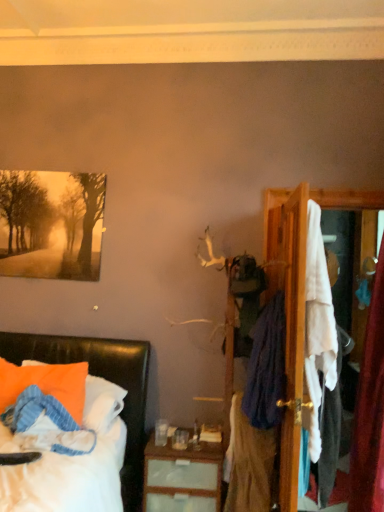
Identify the location of matte paper painting at upper left. (51, 224).

The width and height of the screenshot is (384, 512). Describe the element at coordinates (248, 463) in the screenshot. I see `velvety purple scarf at right, the second clothing when ordered from top to bottom` at that location.

You are a GUI agent. You are given a task and a screenshot of the screen. Output one action in this format:
    pyautogui.click(x=<x>, y=<y>)
    Task: Click on the dark blue fabric at right, the 1th clothing positioned from the top
    This screenshot has width=384, height=512.
    Given the screenshot: What is the action you would take?
    pyautogui.click(x=266, y=367)

The width and height of the screenshot is (384, 512). Find the location of `matte black bed at lower left`. matte black bed at lower left is located at coordinates (105, 378).

You are a GUI agent. You are given a task and a screenshot of the screen. Output one action in this format:
    pyautogui.click(x=<x>, y=<y>)
    Task: Click on the orange fabric pillow at lower left
    
    Given the screenshot: What is the action you would take?
    pyautogui.click(x=45, y=383)

Is dark blue fabric at right, the 1th clothing positioned from the top, inside or outside of velvety purple scarf at right, which appears as the first clothing when ordered from the bottom?

dark blue fabric at right, the 1th clothing positioned from the top, lies outside velvety purple scarf at right, which appears as the first clothing when ordered from the bottom.

From a real-world perspective, which object stands above the other?

dark blue fabric at right, the 1th clothing positioned from the top.

Is dark blue fabric at right, the second clothing when ordered from bottom to top, taller or shorter than velvety purple scarf at right, the second clothing when ordered from top to bottom?

In the image, dark blue fabric at right, the second clothing when ordered from bottom to top, appears to be taller than velvety purple scarf at right, the second clothing when ordered from top to bottom.

Is velvety purple scarf at right, the second clothing when ordered from top to bottom, at the back of dark blue fabric at right, the 1th clothing positioned from the top?

That's not correct — dark blue fabric at right, the 1th clothing positioned from the top, is not looking away from velvety purple scarf at right, the second clothing when ordered from top to bottom.

From the image's perspective, does matte black bed at lower left appear higher than dark blue fabric at right, the second clothing when ordered from bottom to top?

Incorrect, from the image's perspective, matte black bed at lower left is lower than dark blue fabric at right, the second clothing when ordered from bottom to top.

Is matte black bed at lower left bigger than dark blue fabric at right, the 1th clothing positioned from the top?

Yes.

Where is `bed that is below the dark blue fabric at right, the 1th clothing positioned from the top (from the image's perspective)`? The width and height of the screenshot is (384, 512). bed that is below the dark blue fabric at right, the 1th clothing positioned from the top (from the image's perspective) is located at coordinates (105, 378).

Is velvety purple scarf at right, the second clothing when ordered from top to bottom, surrounding wooden dresser at right?

No.

From a real-world perspective, which object rests below the other?

In real-world perspective, velvety purple scarf at right, the second clothing when ordered from top to bottom, is lower.

Considering the positions of objects velvety purple scarf at right, the second clothing when ordered from top to bottom, and wooden dresser at right in the image provided, who is in front, velvety purple scarf at right, the second clothing when ordered from top to bottom, or wooden dresser at right?

velvety purple scarf at right, the second clothing when ordered from top to bottom, is in front.

Does velvety purple scarf at right, the second clothing when ordered from top to bottom, touch wooden dresser at right?

No, velvety purple scarf at right, the second clothing when ordered from top to bottom, is not touching wooden dresser at right.

Considering the relative positions of dark blue fabric at right, the second clothing when ordered from bottom to top, and matte paper painting at upper left in the image provided, is dark blue fabric at right, the second clothing when ordered from bottom to top, in front of matte paper painting at upper left?

Yes, it is.

Is dark blue fabric at right, the 1th clothing positioned from the top, situated inside matte paper painting at upper left or outside?

dark blue fabric at right, the 1th clothing positioned from the top, is located beyond the bounds of matte paper painting at upper left.

Would you consider dark blue fabric at right, the second clothing when ordered from bottom to top, to be distant from matte paper painting at upper left?

Yes.

Does dark blue fabric at right, the second clothing when ordered from bottom to top, have a lesser width compared to matte paper painting at upper left?

In fact, dark blue fabric at right, the second clothing when ordered from bottom to top, might be wider than matte paper painting at upper left.

Which of these two, velvety purple scarf at right, the second clothing when ordered from top to bottom, or dark blue fabric at right, the 1th clothing positioned from the top, is smaller?

velvety purple scarf at right, the second clothing when ordered from top to bottom.

Considering the sizes of objects velvety purple scarf at right, the second clothing when ordered from top to bottom, and dark blue fabric at right, the second clothing when ordered from bottom to top, in the image provided, who is shorter, velvety purple scarf at right, the second clothing when ordered from top to bottom, or dark blue fabric at right, the second clothing when ordered from bottom to top,?

With less height is velvety purple scarf at right, the second clothing when ordered from top to bottom.

Is velvety purple scarf at right, the second clothing when ordered from top to bottom, looking in the opposite direction of dark blue fabric at right, the 1th clothing positioned from the top?

No.

Which object is thinner, velvety purple scarf at right, which appears as the first clothing when ordered from the bottom, or dark blue fabric at right, the 1th clothing positioned from the top?

With smaller width is dark blue fabric at right, the 1th clothing positioned from the top.

Is orange fabric pillow at lower left oriented away from matte black bed at lower left?

Yes, orange fabric pillow at lower left is positioned with its back facing matte black bed at lower left.

From the image's perspective, would you say orange fabric pillow at lower left is shown under matte black bed at lower left?

Incorrect, from the image's perspective, orange fabric pillow at lower left is higher than matte black bed at lower left.

Relative to matte black bed at lower left, is orange fabric pillow at lower left in front or behind?

Visually, orange fabric pillow at lower left is located behind matte black bed at lower left.

Considering the sizes of objects orange fabric pillow at lower left and matte black bed at lower left in the image provided, who is bigger, orange fabric pillow at lower left or matte black bed at lower left?

With larger size is matte black bed at lower left.

Who is smaller, wooden dresser at right or dark blue fabric at right, the second clothing when ordered from bottom to top?

With smaller size is dark blue fabric at right, the second clothing when ordered from bottom to top.

Are wooden dresser at right and dark blue fabric at right, the second clothing when ordered from bottom to top, beside each other?

wooden dresser at right and dark blue fabric at right, the second clothing when ordered from bottom to top, are not in contact.

Does wooden dresser at right have a lesser width compared to dark blue fabric at right, the 1th clothing positioned from the top?

Correct, the width of wooden dresser at right is less than that of dark blue fabric at right, the 1th clothing positioned from the top.

From a real-world perspective, is wooden dresser at right on dark blue fabric at right, the 1th clothing positioned from the top?

Indeed, from a real-world perspective, wooden dresser at right stands above dark blue fabric at right, the 1th clothing positioned from the top.

Where is `clothing positioned vertically above the velvety purple scarf at right, the second clothing when ordered from top to bottom (from a real-world perspective)`? Image resolution: width=384 pixels, height=512 pixels. clothing positioned vertically above the velvety purple scarf at right, the second clothing when ordered from top to bottom (from a real-world perspective) is located at coordinates (266, 367).

Where is `clothing above the matte black bed at lower left (from the image's perspective)`? clothing above the matte black bed at lower left (from the image's perspective) is located at coordinates (266, 367).

Based on their spatial positions, is matte black bed at lower left or velvety purple scarf at right, which appears as the first clothing when ordered from the bottom, further from orange fabric pillow at lower left?

velvety purple scarf at right, which appears as the first clothing when ordered from the bottom.

From the image, which object appears to be nearer to dark blue fabric at right, the second clothing when ordered from bottom to top, velvety purple scarf at right, which appears as the first clothing when ordered from the bottom, or matte paper painting at upper left?

velvety purple scarf at right, which appears as the first clothing when ordered from the bottom, is positioned closer to the anchor dark blue fabric at right, the second clothing when ordered from bottom to top.

From the image, which object appears to be nearer to wooden dresser at right, matte black bed at lower left or dark blue fabric at right, the second clothing when ordered from bottom to top?

dark blue fabric at right, the second clothing when ordered from bottom to top, is positioned closer to the anchor wooden dresser at right.

Based on the photo, when comparing their distances from matte paper painting at upper left, does wooden dresser at right or dark blue fabric at right, the 1th clothing positioned from the top, seem closer?

wooden dresser at right is positioned closer to the anchor matte paper painting at upper left.

When comparing their distances from velvety purple scarf at right, the second clothing when ordered from top to bottom, does wooden dresser at right or dark blue fabric at right, the second clothing when ordered from bottom to top, seem further?

Based on the image, wooden dresser at right appears to be further to velvety purple scarf at right, the second clothing when ordered from top to bottom.

Based on their spatial positions, is matte black bed at lower left or wooden dresser at right further from orange fabric pillow at lower left?

wooden dresser at right is further to orange fabric pillow at lower left.

From the image, which object appears to be farther from velvety purple scarf at right, which appears as the first clothing when ordered from the bottom, matte black bed at lower left or wooden dresser at right?

matte black bed at lower left is further to velvety purple scarf at right, which appears as the first clothing when ordered from the bottom.

Considering their positions, is orange fabric pillow at lower left positioned further to matte paper painting at upper left than wooden dresser at right?

Among the two, wooden dresser at right is located further to matte paper painting at upper left.

Where is `clothing between velvety purple scarf at right, which appears as the first clothing when ordered from the bottom, and wooden dresser at right, in the horizontal direction`? The width and height of the screenshot is (384, 512). clothing between velvety purple scarf at right, which appears as the first clothing when ordered from the bottom, and wooden dresser at right, in the horizontal direction is located at coordinates (266, 367).

Identify the location of clothing between matte paper painting at upper left and dark blue fabric at right, the second clothing when ordered from bottom to top, from left to right. The width and height of the screenshot is (384, 512). (248, 463).

The image size is (384, 512). Identify the location of pillow located between matte black bed at lower left and dark blue fabric at right, the 1th clothing positioned from the top, in the left-right direction. (45, 383).

I want to click on clothing situated between matte black bed at lower left and dark blue fabric at right, the second clothing when ordered from bottom to top, from left to right, so click(248, 463).